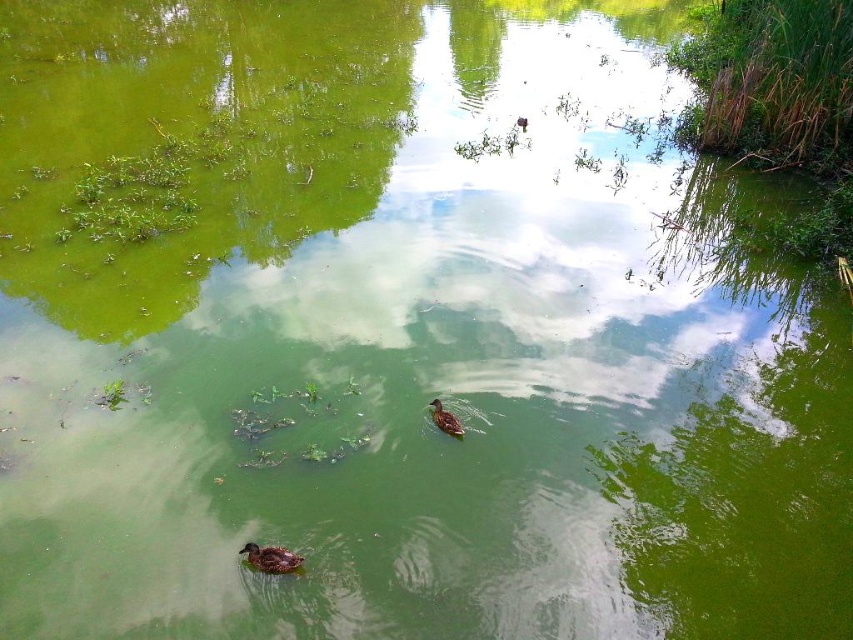
From the picture: You are a photographer trying to capture the brown fuzzy duckling at lower left in the center of your photo. Given that your camera has a rectangular viewfinder with a 3x2 aspect ratio, what adjustments should you make to frame the duckling properly?

To center the brown fuzzy duckling at lower left, adjust the camera so the duckling is positioned at the intersection of the viewfinder grid lines, ensuring it sits at the center point. Since the viewfinder has a 3x2 aspect ratio, you may need to pan slightly upward and to the right to bring the duckling into the central area while maintaining the desired composition.

You are a photographer trying to capture a closeup of the brown fuzzy duckling at lower left and the brown feathered duck at center. Which duck is wider so that you can focus your camera lens properly?

The brown fuzzy duckling at lower left might be wider than brown feathered duck at center.